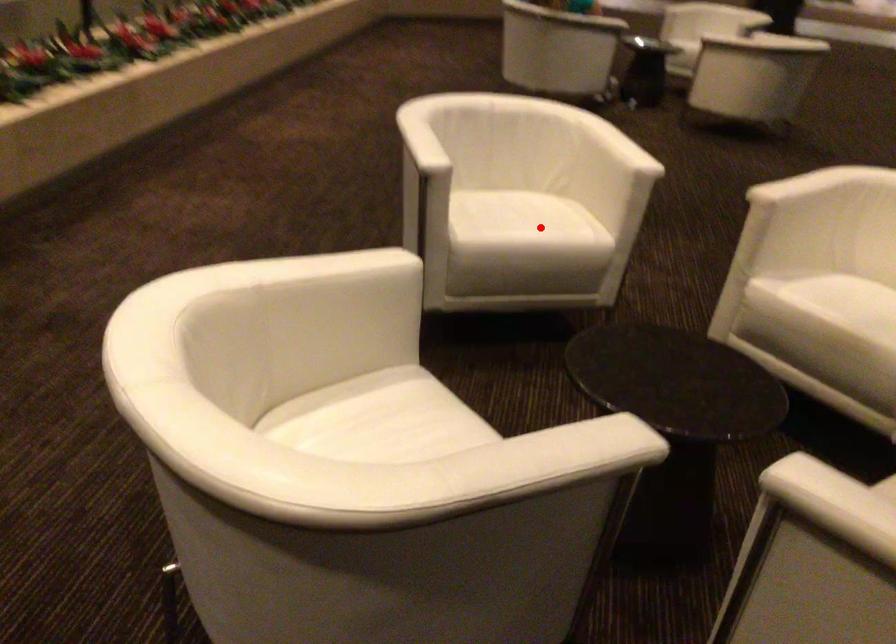
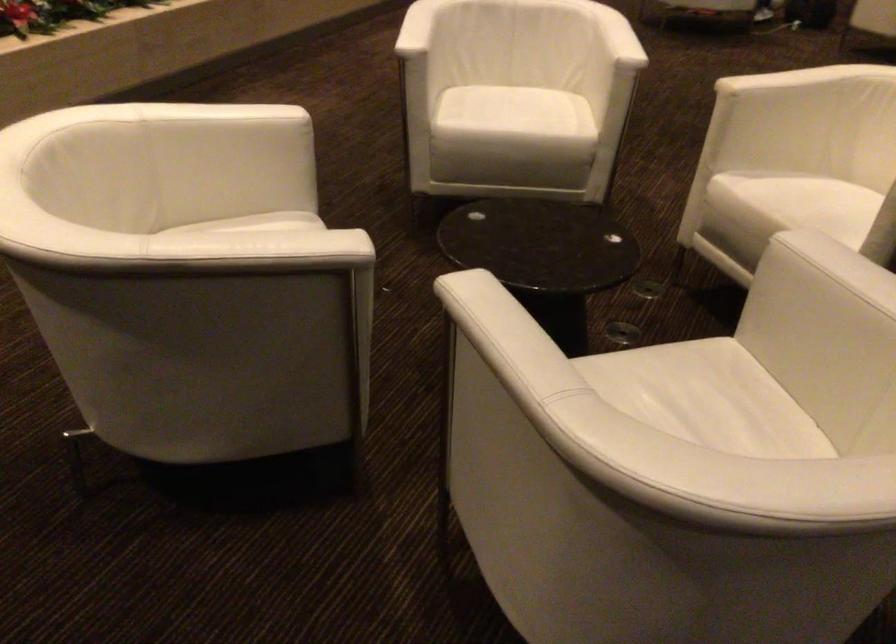
Where in the second image is the point corresponding to the highlighted location from the first image?

(524, 117)